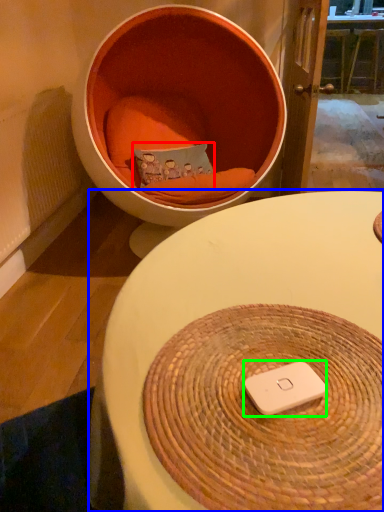
Question: Which object is positioned farthest from pillow (highlighted by a red box)? Select from table (highlighted by a blue box) and ipod (highlighted by a green box).

Choices:
 (A) table
 (B) ipod

Answer: (B)